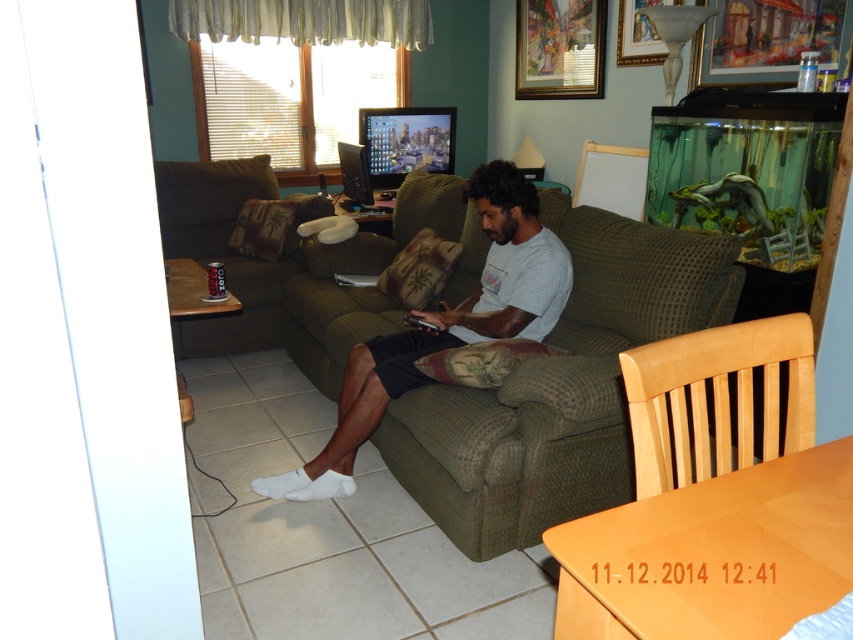
You are standing in the living room and want to place a small plant between the two points, point (512, 285) and point (286, 260). Which point should the plant be closer to so it is in front of the other?

The plant should be closer to point (512, 285) because it is in front of point (286, 260).

You are a visitor entering the living room and want to sit down. You see the light brown wooden chair at lower right and the green fabric couch at left. Which one is shorter and would be easier to sit on if you have mobility issues?

The light brown wooden chair at lower right is shorter than the green fabric couch at left, making it easier to sit on for someone with mobility issues.

You are planning to host a small gathering in your living room and need to seat 4 guests. You have the light brown wooden chair at lower right and the green fabric couch at left. Considering their sizes, which furniture item can accommodate more people?

The green fabric couch at left can accommodate more people than the light brown wooden chair at lower right because it has a larger size.